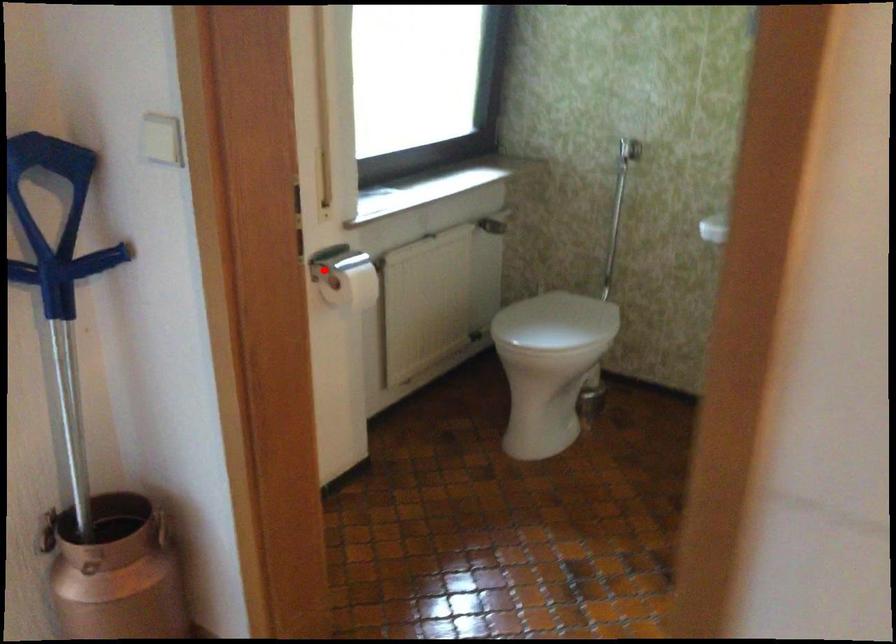
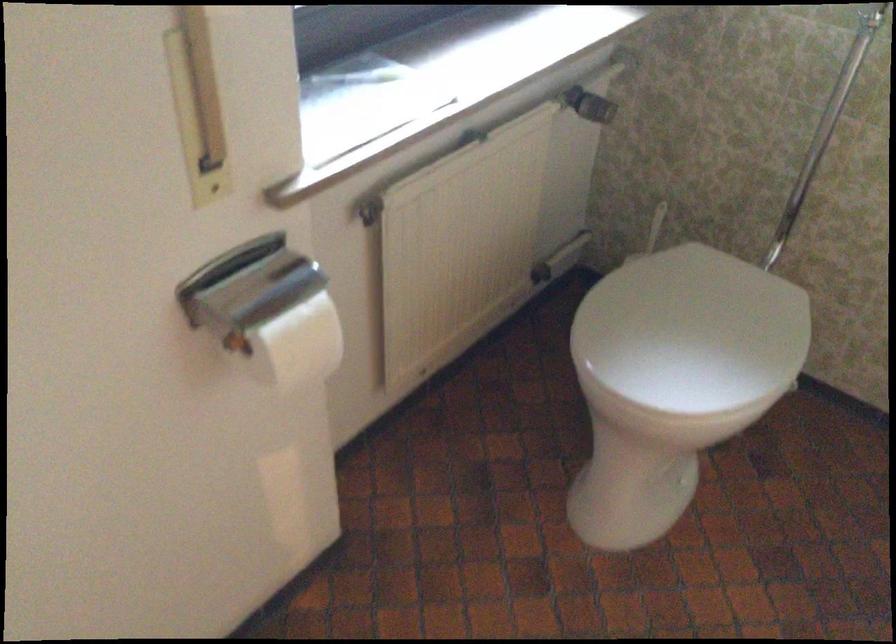
Question: A red point is marked in image1. In image2, is the corresponding 3D point closer to the camera or farther? Reply with the corresponding letter.

Choices:
 (A) The corresponding 3D point is closer.
 (B) The corresponding 3D point is farther.

Answer: (A)